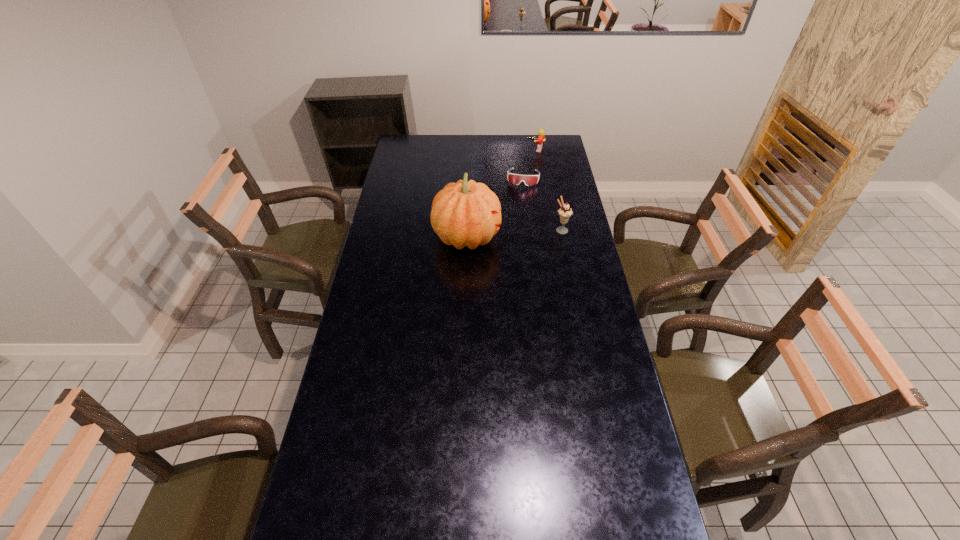
What are the coordinates of `vacant area at the far edge` in the screenshot? It's located at (504, 146).

In the image, there is a desktop. Where is `free region at the near edge`? The height and width of the screenshot is (540, 960). free region at the near edge is located at coordinates (564, 492).

This screenshot has width=960, height=540. What are the coordinates of `vacant space at the left edge of the desktop` in the screenshot? It's located at (357, 411).

Find the location of a particular element. free location at the right edge of the desktop is located at coordinates (588, 395).

This screenshot has height=540, width=960. Find the location of `free spot at the near left corner of the desktop`. free spot at the near left corner of the desktop is located at coordinates (312, 517).

In the image, there is a desktop. Identify the location of vacant space at the near right corner. (602, 507).

At what (x,y) coordinates should I click in order to perform the action: click on empty space that is in between the goggles and the third shortest object. Please return your answer as a coordinate pair (x, y). This screenshot has height=540, width=960. Looking at the image, I should click on (542, 204).

Find the location of a particular element. The width and height of the screenshot is (960, 540). free spot between the third nearest object and the farthest object is located at coordinates (529, 164).

Find the location of a particular element. vacant space in between the Lego and the shortest object is located at coordinates (529, 164).

Identify the location of vacant region between the leftmost object and the farthest object. (501, 193).